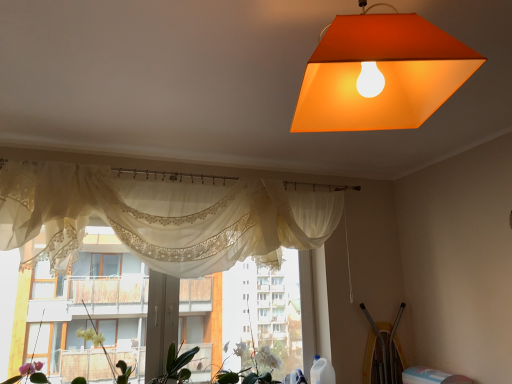
Question: In terms of size, does green leafy plant at center, which appears as the 3th plant when viewed from the right, appear bigger or smaller than sheer lace curtains at center?

Choices:
 (A) big
 (B) small

Answer: (B)

Question: Is green leafy plant at center, the first plant when ordered from left to right, wider or thinner than sheer lace curtains at center?

Choices:
 (A) wide
 (B) thin

Answer: (A)

Question: Estimate the real-world distances between objects in this image. Which object is closer to the green matte plant at lower center, the 2th plant viewed from the right?

Choices:
 (A) orange matte lampshade at upper center
 (B) white matte plant at center, the 1th plant viewed from the right
 (C) sheer white curtain at center
 (D) sheer lace curtains at center
 (E) green leafy plant at center, the first plant when ordered from left to right

Answer: (E)

Question: Which object is positioned farthest from the white matte plant at center, placed as the 3th plant when sorted from left to right?

Choices:
 (A) sheer white curtain at center
 (B) green matte plant at lower center, the 2th plant viewed from the right
 (C) green leafy plant at center, which appears as the 3th plant when viewed from the right
 (D) sheer lace curtains at center
 (E) orange matte lampshade at upper center

Answer: (E)